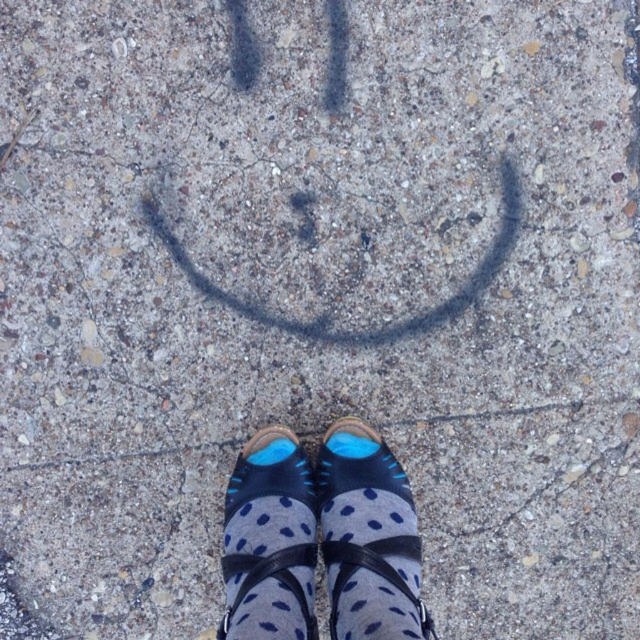
Question: Does blue fabric socks at center have a larger size compared to blue suede shoe at center?

Choices:
 (A) yes
 (B) no

Answer: (A)

Question: Which of the following is the farthest from the observer?

Choices:
 (A) blue fabric socks at center
 (B) blue suede shoe at center

Answer: (B)

Question: Does blue fabric socks at center appear on the right side of blue suede shoe at center?

Choices:
 (A) no
 (B) yes

Answer: (B)

Question: Among these objects, which one is farthest from the camera?

Choices:
 (A) blue fabric socks at center
 (B) blue suede shoe at center

Answer: (B)

Question: Is blue fabric socks at center above blue suede shoe at center?

Choices:
 (A) no
 (B) yes

Answer: (B)